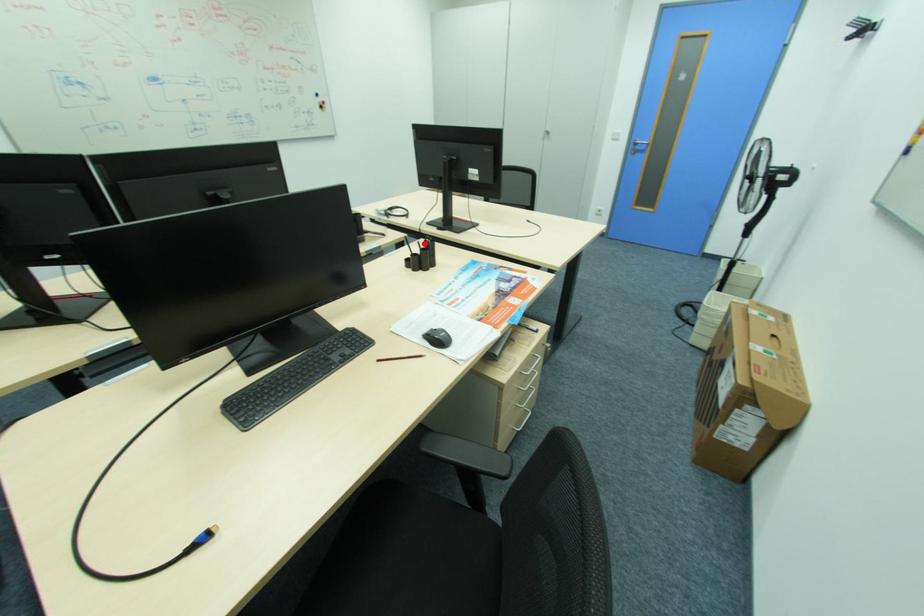
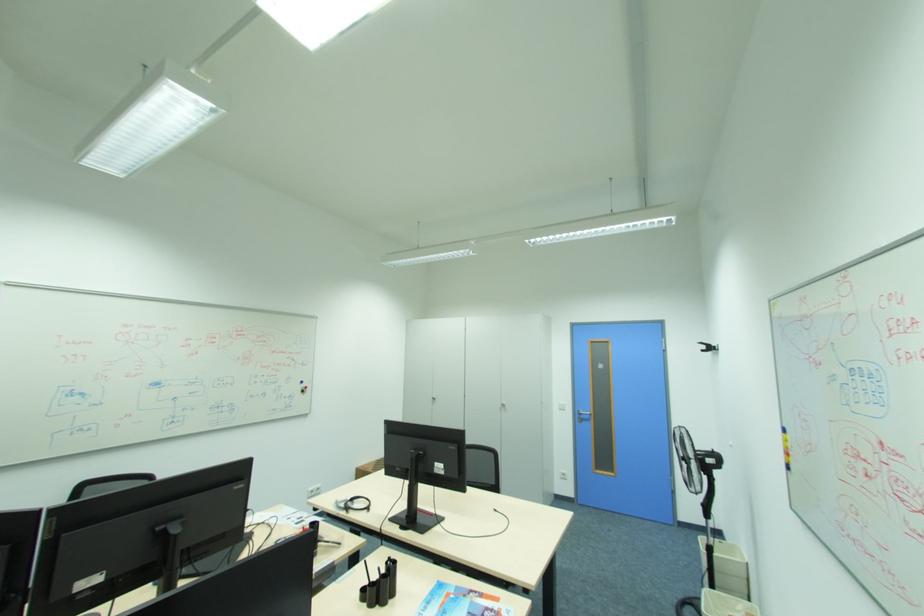
Question: I am providing you with two images of the same scene from different viewpoints. A red point is shown in image1. For the corresponding object point in image2, is it positioned nearer or farther from the camera?

Choices:
 (A) Nearer
 (B) Farther

Answer: (B)